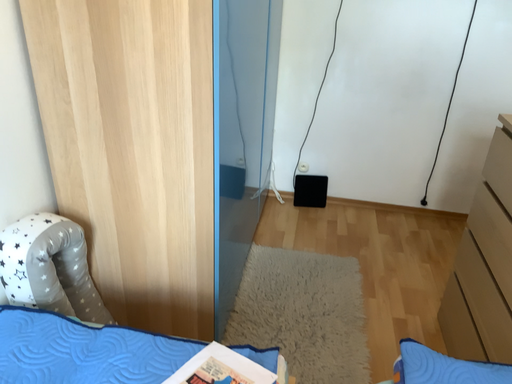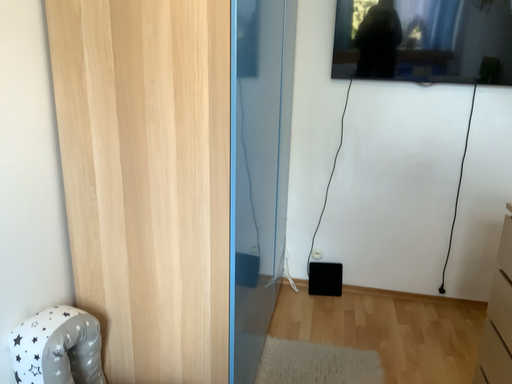
Question: Which way did the camera rotate in the video?

Choices:
 (A) rotated upward
 (B) rotated downward

Answer: (A)